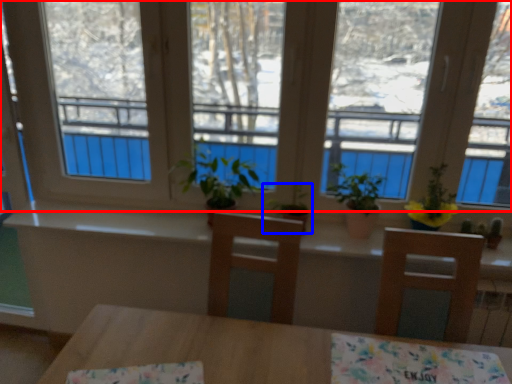
Question: Among these objects, which one is farthest to the camera, window (highlighted by a red box) or houseplant (highlighted by a blue box)?

Choices:
 (A) window
 (B) houseplant

Answer: (B)